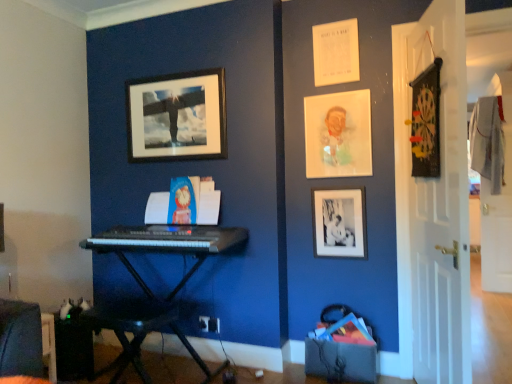
This screenshot has width=512, height=384. I want to click on empty space that is ontop of black matte picture frame at upper center, arranged as the 1th picture frame when viewed from the left (from a real-world perspective), so click(172, 75).